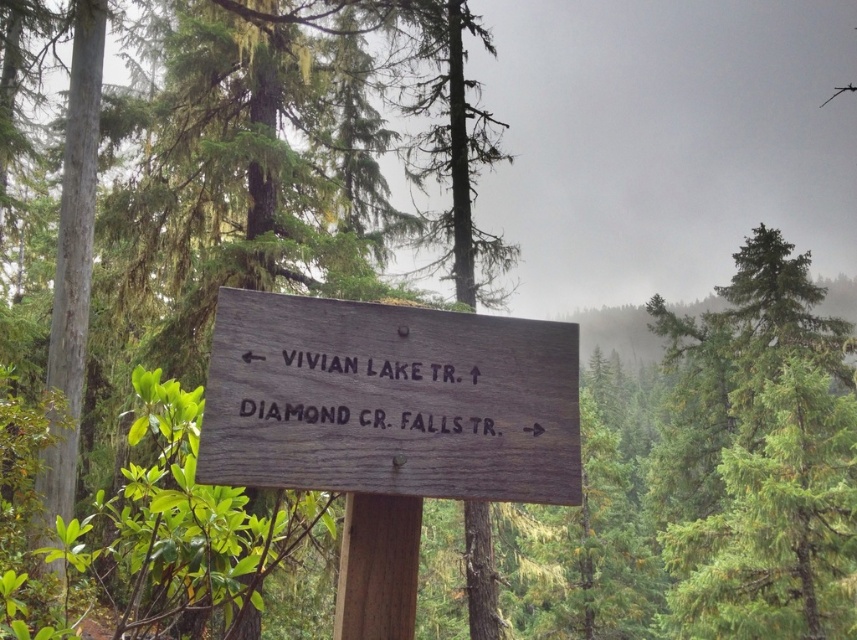
Between point (477, 152) and point (406, 528), which one is positioned behind?

Point (477, 152)

Which is behind, point (291, 54) or point (381, 566)?

Point (291, 54)

The image size is (857, 640). I want to click on green wood sign at center, so 255,157.

Can you confirm if weathered wood sign at center is positioned to the right of brown wooden post at center?

Indeed, weathered wood sign at center is positioned on the right side of brown wooden post at center.

Who is more distant from viewer, (249,387) or (399,561)?

Positioned behind is point (399,561).

Find the location of a particular element. This screenshot has width=857, height=640. weathered wood sign at center is located at coordinates (388, 401).

Where is `weathered wood sign at center`? weathered wood sign at center is located at coordinates (388, 401).

Can you confirm if green wood sign at center is positioned to the right of weathered wood sign at center?

Yes, green wood sign at center is to the right of weathered wood sign at center.

Is green wood sign at center closer to camera compared to weathered wood sign at center?

No, it is not.

Describe the element at coordinates (255, 157) in the screenshot. I see `green wood sign at center` at that location.

This screenshot has height=640, width=857. In order to click on green wood sign at center in this screenshot , I will do pyautogui.click(x=255, y=157).